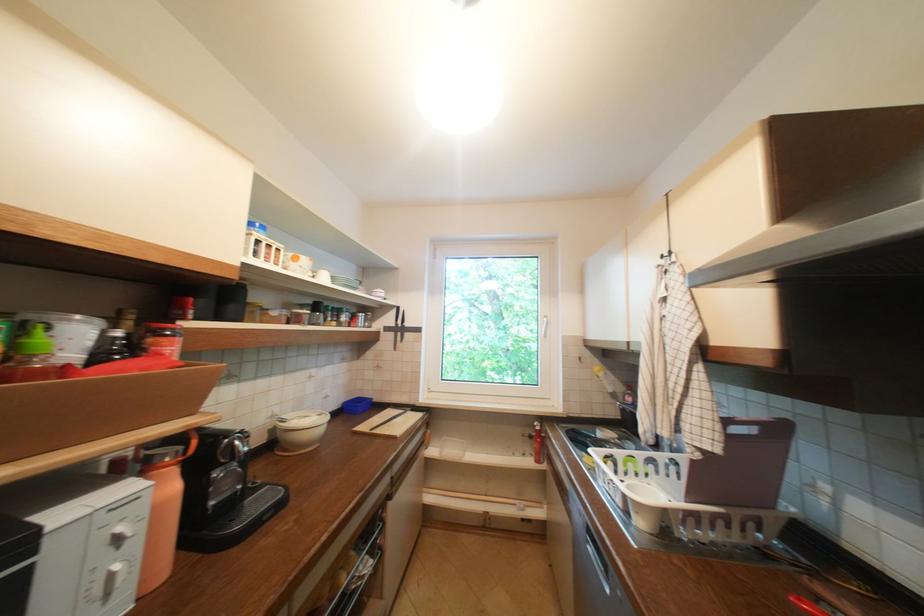
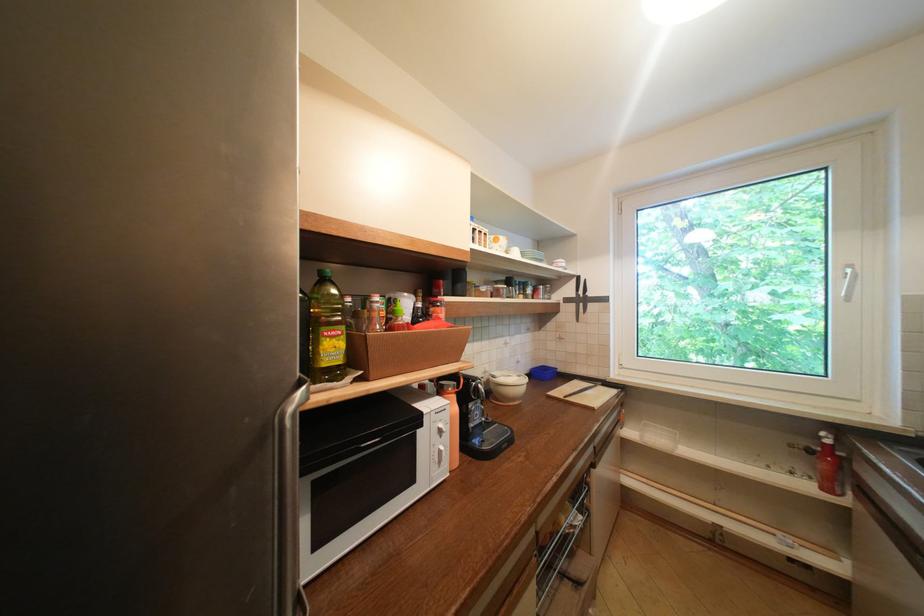
In the second image, find the point that corresponds to [395,330] in the first image.

(575, 301)